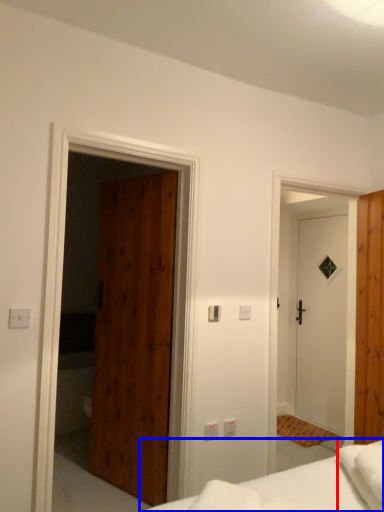
Question: Among these objects, which one is farthest to the camera, sheet (highlighted by a red box) or bed (highlighted by a blue box)?

Choices:
 (A) sheet
 (B) bed

Answer: (A)